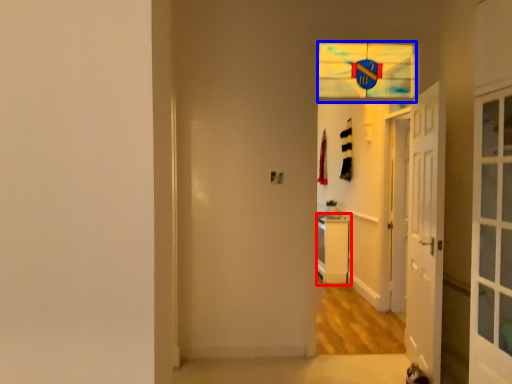
Question: Among these objects, which one is nearest to the camera, dresser (highlighted by a red box) or glass window (highlighted by a blue box)?

Choices:
 (A) dresser
 (B) glass window

Answer: (B)